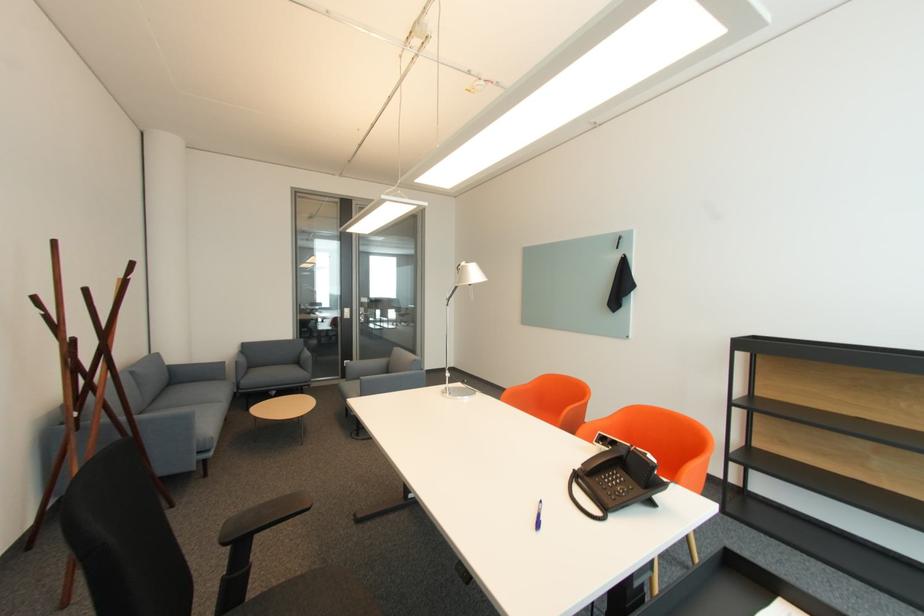
Where would you hang the black wall hook? Please return your answer as a coordinate pair (x, y).

(617, 241)